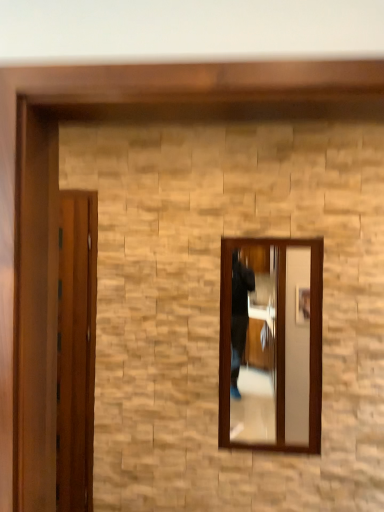
Question: Is clear glass mirror at center inside the boundaries of wooden door at left, or outside?

Choices:
 (A) inside
 (B) outside

Answer: (B)

Question: From the image's perspective, is clear glass mirror at center located above or below wooden door at left?

Choices:
 (A) above
 (B) below

Answer: (A)

Question: Visually, is clear glass mirror at center positioned to the left or to the right of wooden door at left?

Choices:
 (A) left
 (B) right

Answer: (B)

Question: Based on their positions, is wooden door at left located to the left or right of clear glass mirror at center?

Choices:
 (A) left
 (B) right

Answer: (A)

Question: Choose the correct answer: Is wooden door at left inside clear glass mirror at center or outside it?

Choices:
 (A) inside
 (B) outside

Answer: (B)

Question: From a real-world perspective, is wooden door at left positioned above or below clear glass mirror at center?

Choices:
 (A) above
 (B) below

Answer: (B)

Question: Is point (71, 386) positioned closer to the camera than point (283, 407)?

Choices:
 (A) farther
 (B) closer

Answer: (A)